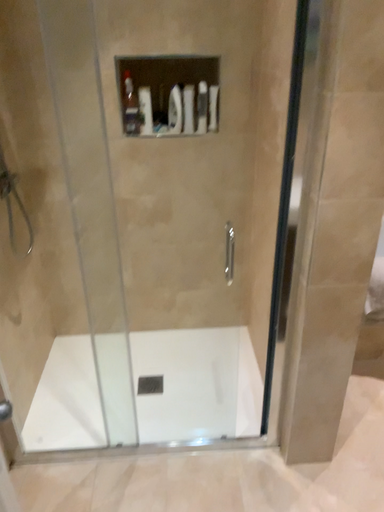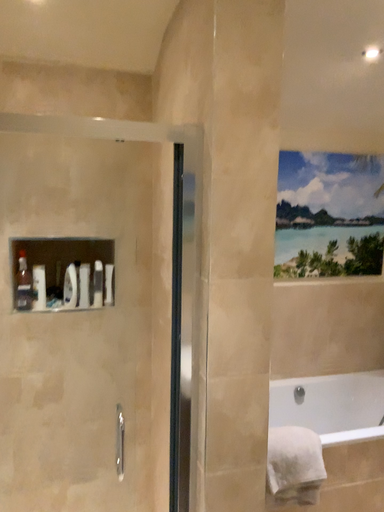
Question: Which way did the camera rotate in the video?

Choices:
 (A) rotated upward
 (B) rotated downward

Answer: (A)